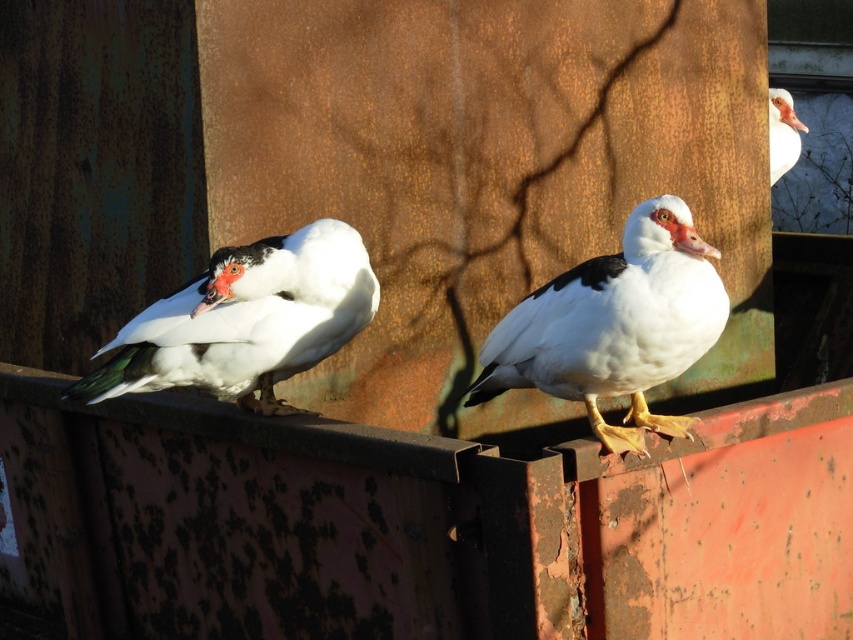
You are a photographer trying to capture a photo of the ducks. You notice the white matte duck at left and the white matte duck at upper right. Which duck is positioned higher in the image?

The white matte duck at left is much taller than the white matte duck at upper right, so it is positioned higher in the image.

You are a wildlife photographer aiming to capture a closeup shot of the white matte duck at left and the white matte duck at upper right. Given that your camera lens can only focus on objects within a 1.5 meter width, will both ducks fit in the frame?

The white matte duck at left is larger in width than the white matte duck at upper right. However, the camera lens can accommodate objects within a 1.5 meter width, so both ducks can fit in the frame as long as their combined or individual widths do not exceed this limit. The exact fit depends on their actual sizes relative to the 1.5 meters.